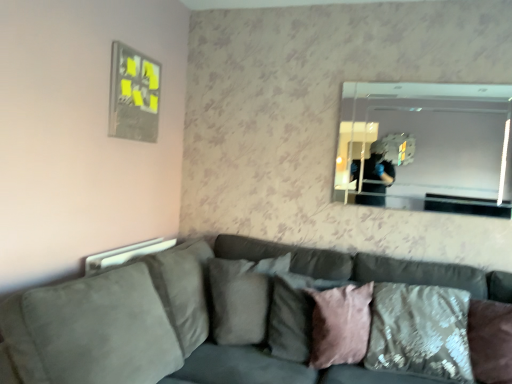
Question: Would you consider velvet textured pillow at lower right, marked as the 1th pillow in a right-to-left arrangement, to be distant from pink velvet pillow at center, the 3th pillow from the left?

Choices:
 (A) no
 (B) yes

Answer: (A)

Question: From a real-world perspective, is velvet textured pillow at lower right, marked as the 1th pillow in a right-to-left arrangement, over pink velvet pillow at center, the 3th pillow from the left?

Choices:
 (A) yes
 (B) no

Answer: (A)

Question: Does velvet textured pillow at lower right, the 4th pillow in the left-to-right sequence, contain pink velvet pillow at center, the 3th pillow from the left?

Choices:
 (A) no
 (B) yes

Answer: (B)

Question: Can you confirm if velvet textured pillow at lower right, the 4th pillow in the left-to-right sequence, is positioned to the left of pink velvet pillow at center, the 3th pillow from the left?

Choices:
 (A) no
 (B) yes

Answer: (A)

Question: Does velvet textured pillow at lower right, marked as the 1th pillow in a right-to-left arrangement, have a lesser width compared to pink velvet pillow at center, the 3th pillow from the left?

Choices:
 (A) yes
 (B) no

Answer: (B)

Question: Considering the positions of point (270, 301) and point (214, 273), is point (270, 301) closer or farther from the camera than point (214, 273)?

Choices:
 (A) closer
 (B) farther

Answer: (A)

Question: In terms of width, does pink velvet pillow at center, arranged as the 2th pillow when viewed from the left, look wider or thinner when compared to suede-like gray pillow at center, arranged as the 1th pillow when viewed from the left?

Choices:
 (A) thin
 (B) wide

Answer: (A)

Question: From their relative heights in the image, would you say pink velvet pillow at center, arranged as the 2th pillow when viewed from the left, is taller or shorter than suede-like gray pillow at center, arranged as the 1th pillow when viewed from the left?

Choices:
 (A) short
 (B) tall

Answer: (A)

Question: Do you think pink velvet pillow at center, arranged as the 3th pillow when viewed from the right, is within suede-like gray pillow at center, arranged as the 1th pillow when viewed from the left, or outside of it?

Choices:
 (A) inside
 (B) outside

Answer: (B)

Question: In terms of size, does velvet textured pillow at lower right, the 4th pillow in the left-to-right sequence, appear bigger or smaller than metallic silver picture frame at upper left?

Choices:
 (A) small
 (B) big

Answer: (B)

Question: From a real-world perspective, is velvet textured pillow at lower right, marked as the 1th pillow in a right-to-left arrangement, above or below metallic silver picture frame at upper left?

Choices:
 (A) below
 (B) above

Answer: (A)

Question: Choose the correct answer: Is velvet textured pillow at lower right, the 4th pillow in the left-to-right sequence, inside metallic silver picture frame at upper left or outside it?

Choices:
 (A) outside
 (B) inside

Answer: (A)

Question: Considering the positions of velvet textured pillow at lower right, marked as the 1th pillow in a right-to-left arrangement, and metallic silver picture frame at upper left in the image, is velvet textured pillow at lower right, marked as the 1th pillow in a right-to-left arrangement, taller or shorter than metallic silver picture frame at upper left?

Choices:
 (A) tall
 (B) short

Answer: (A)

Question: Considering the positions of velvet textured pillow at lower right, marked as the 1th pillow in a right-to-left arrangement, and suede gray couch at center in the image, is velvet textured pillow at lower right, marked as the 1th pillow in a right-to-left arrangement, wider or thinner than suede gray couch at center?

Choices:
 (A) wide
 (B) thin

Answer: (B)

Question: In terms of size, does velvet textured pillow at lower right, the 4th pillow in the left-to-right sequence, appear bigger or smaller than suede gray couch at center?

Choices:
 (A) big
 (B) small

Answer: (B)